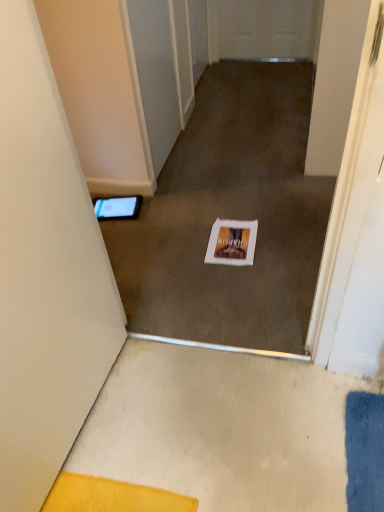
At what (x,y) coordinates should I click in order to perform the action: click on vacant space to the right of black glossy tablet at left. Please return your answer as a coordinate pair (x, y). This screenshot has width=384, height=512. Looking at the image, I should click on (156, 212).